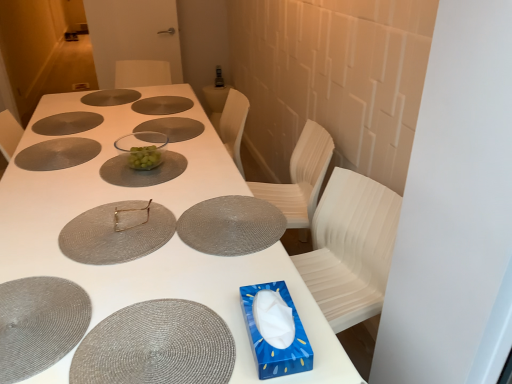
The image size is (512, 384). I want to click on free point above white matte table at center (from a real-world perspective), so tap(105, 207).